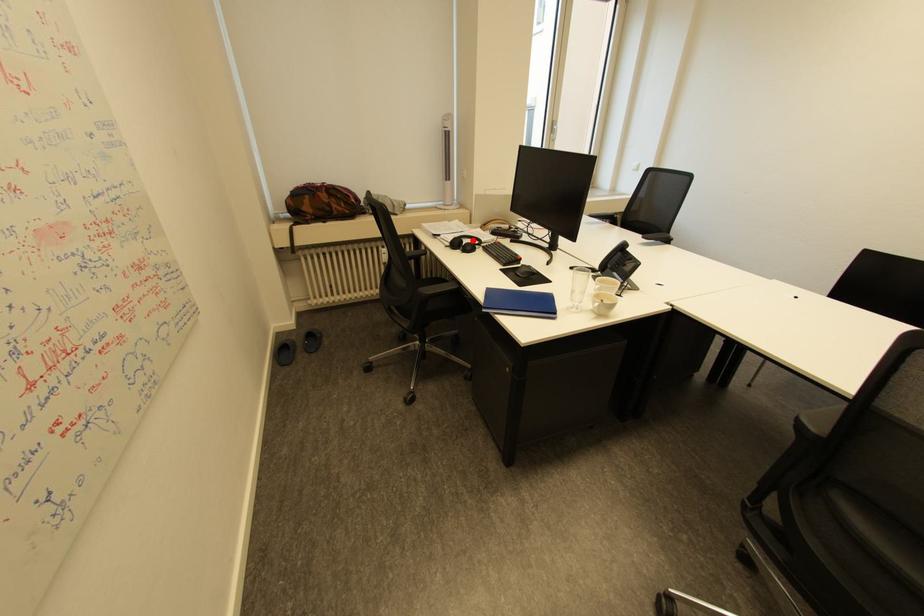
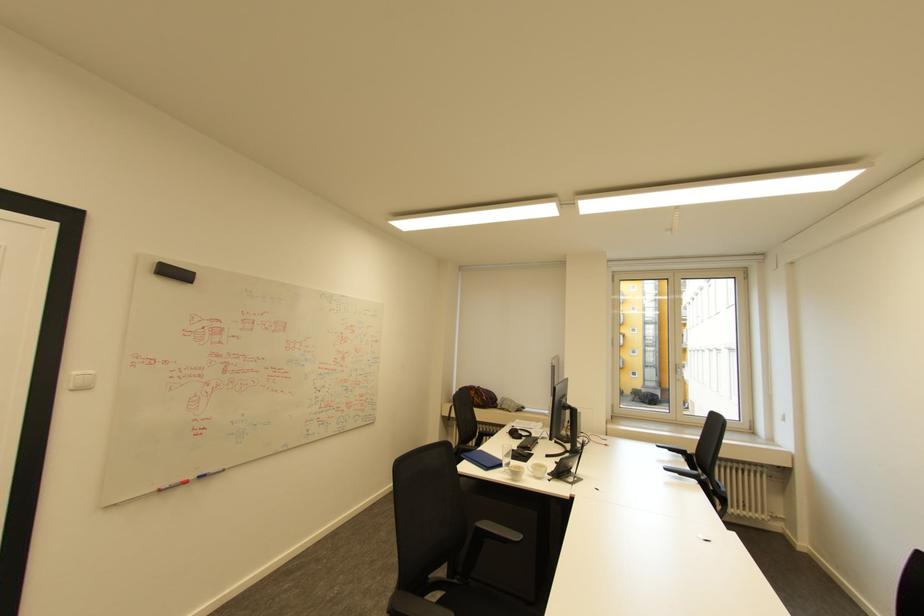
Question: A red point is marked in image1. In image2, is the corresponding 3D point closer to the camera or farther? Reply with the corresponding letter.

Choices:
 (A) The corresponding 3D point is closer.
 (B) The corresponding 3D point is farther.

Answer: (B)